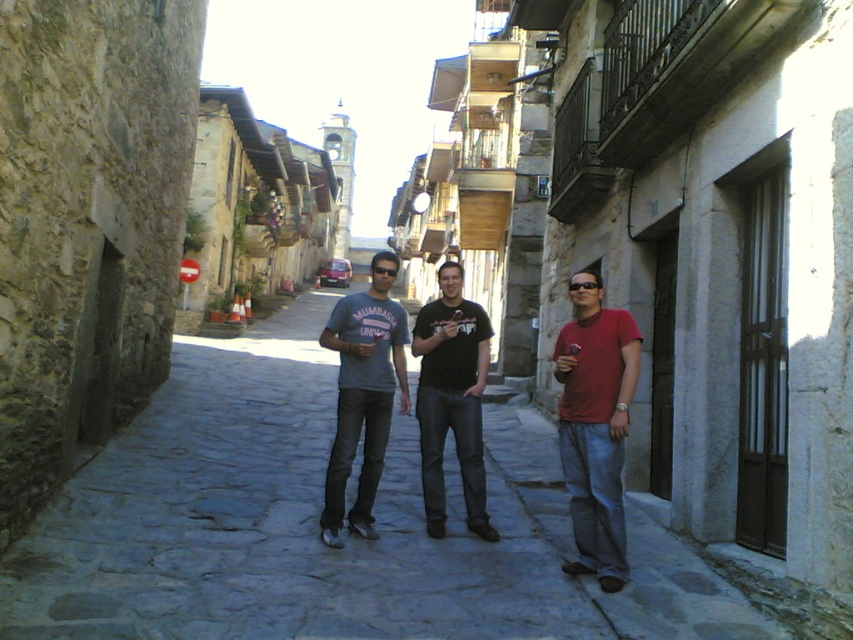
Question: Can you confirm if matte red shirt at right is positioned to the left of matte gray t-shirt at center?

Choices:
 (A) yes
 (B) no

Answer: (B)

Question: Which of these objects is positioned farthest from the black cotton t-shirt at center?

Choices:
 (A) matte gray t-shirt at center
 (B) matte red shirt at right

Answer: (A)

Question: Which of the following is the farthest from the observer?

Choices:
 (A) pyautogui.click(x=450, y=424)
 (B) pyautogui.click(x=589, y=596)
 (C) pyautogui.click(x=334, y=492)
 (D) pyautogui.click(x=579, y=490)

Answer: (A)

Question: From the image, what is the correct spatial relationship of gray cobblestone pavement at center in relation to matte red shirt at right?

Choices:
 (A) right
 (B) left

Answer: (B)

Question: Does matte red shirt at right have a greater width compared to black cotton t-shirt at center?

Choices:
 (A) no
 (B) yes

Answer: (A)

Question: Based on their relative distances, which object is farther from the black cotton t-shirt at center?

Choices:
 (A) matte gray t-shirt at center
 (B) matte red shirt at right

Answer: (A)